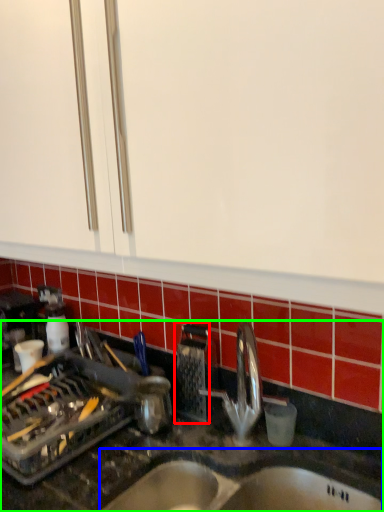
Question: Which object is positioned farthest from appliance (highlighted by a red box)? Select from sink (highlighted by a blue box) and countertop (highlighted by a green box).

Choices:
 (A) sink
 (B) countertop

Answer: (A)